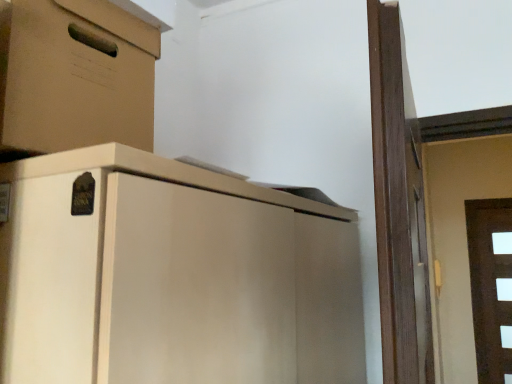
Question: Based on their positions, is matte cardboard box at upper left located to the left or right of white glossy door at right?

Choices:
 (A) left
 (B) right

Answer: (A)

Question: In the image, is matte cardboard box at upper left positioned in front of or behind white glossy door at right?

Choices:
 (A) behind
 (B) front

Answer: (B)

Question: Is matte cardboard box at upper left taller or shorter than white glossy door at right?

Choices:
 (A) tall
 (B) short

Answer: (B)

Question: From a real-world perspective, is white glossy door at right above or below matte cardboard box at upper left?

Choices:
 (A) above
 (B) below

Answer: (B)

Question: Is white glossy door at right wider or thinner than matte cardboard box at upper left?

Choices:
 (A) thin
 (B) wide

Answer: (A)

Question: Considering the positions of white glossy door at right and matte cardboard box at upper left in the image, is white glossy door at right taller or shorter than matte cardboard box at upper left?

Choices:
 (A) tall
 (B) short

Answer: (A)

Question: Is white glossy door at right inside the boundaries of matte cardboard box at upper left, or outside?

Choices:
 (A) inside
 (B) outside

Answer: (B)